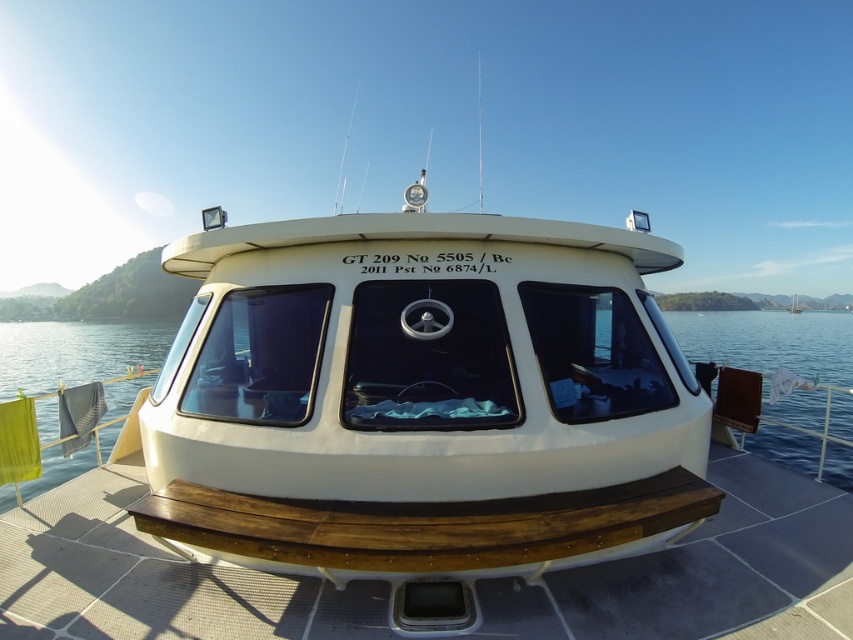
You are standing on the deck of the boat and want to reach the point marked at coordinates (570, 582). Considering your height is 1.75 meters, can you safely step to that point without falling overboard?

The point marked at coordinates (570, 582) is 2.69 meters away from the camera. Since this distance is greater than your height of 1.75 meters, stepping to that point may pose a risk of falling overboard. It is advisable to proceed with caution or use safety equipment.

You are standing on the deck of the boat and want to step onto the transparent glass water at center. Is the brown wood at center blocking your direct path to it?

The brown wood at center is in front of transparent glass water at center, so it is blocking your direct path to the transparent glass water at center.